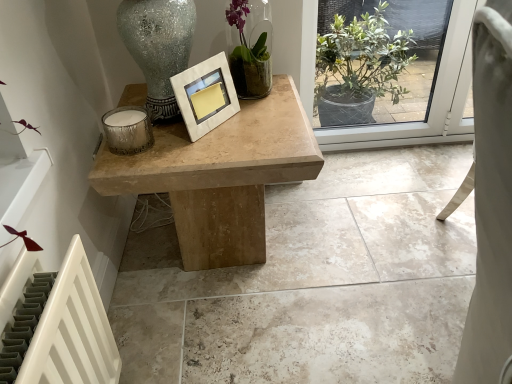
At what (x,y) coordinates should I click in order to perform the action: click on vacant region in front of green glass vase at upper center. Please return your answer as a coordinate pair (x, y). This screenshot has height=384, width=512. Looking at the image, I should click on (260, 116).